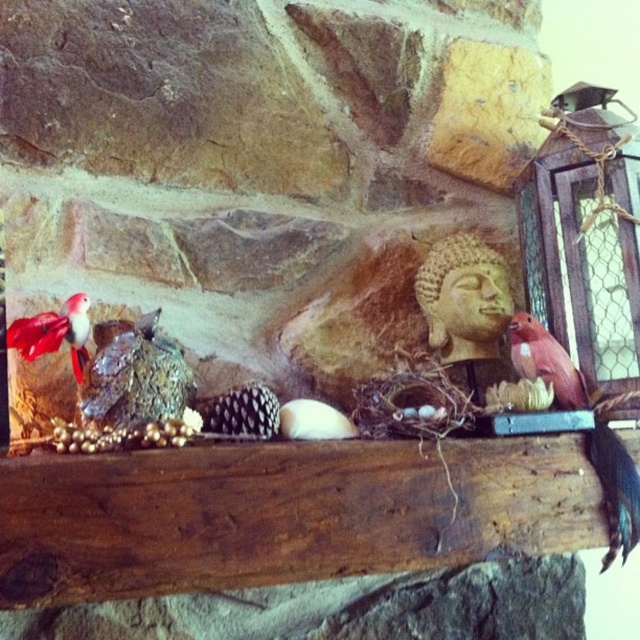
Question: Which is nearer to the matte pink bird at right?

Choices:
 (A) matte pink parrot at right
 (B) matte red bird at left

Answer: (A)

Question: Which of the following is the farthest from the observer?

Choices:
 (A) matte pink parrot at right
 (B) matte red bird at left

Answer: (A)

Question: Is matte pink parrot at right wider than matte pink bird at right?

Choices:
 (A) no
 (B) yes

Answer: (B)

Question: Is matte pink parrot at right bigger than matte pink bird at right?

Choices:
 (A) no
 (B) yes

Answer: (B)

Question: Can you confirm if matte pink parrot at right is positioned to the right of matte pink bird at right?

Choices:
 (A) yes
 (B) no

Answer: (A)

Question: Which point is closer to the camera taking this photo?

Choices:
 (A) (24, 340)
 (B) (564, 390)

Answer: (A)